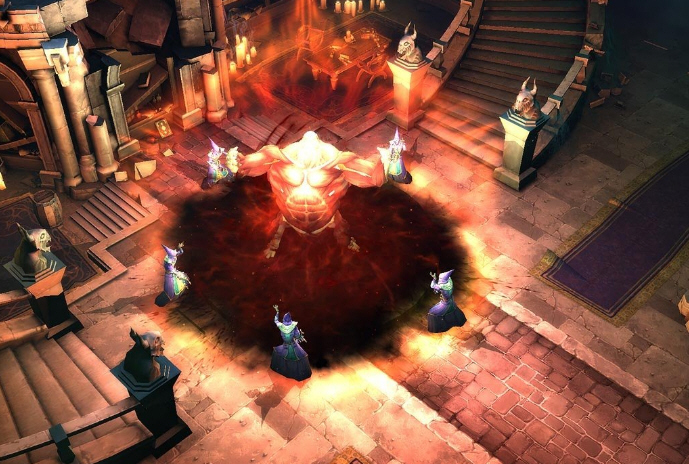
You are a GUI agent. You are given a task and a screenshot of the screen. Output one action in this format:
    pyautogui.click(x=<x>, y=<y>)
    Task: Click on the chest
    Image resolution: width=689 pixels, height=464 pixels.
    Given the screenshot: What is the action you would take?
    pyautogui.click(x=302, y=173)